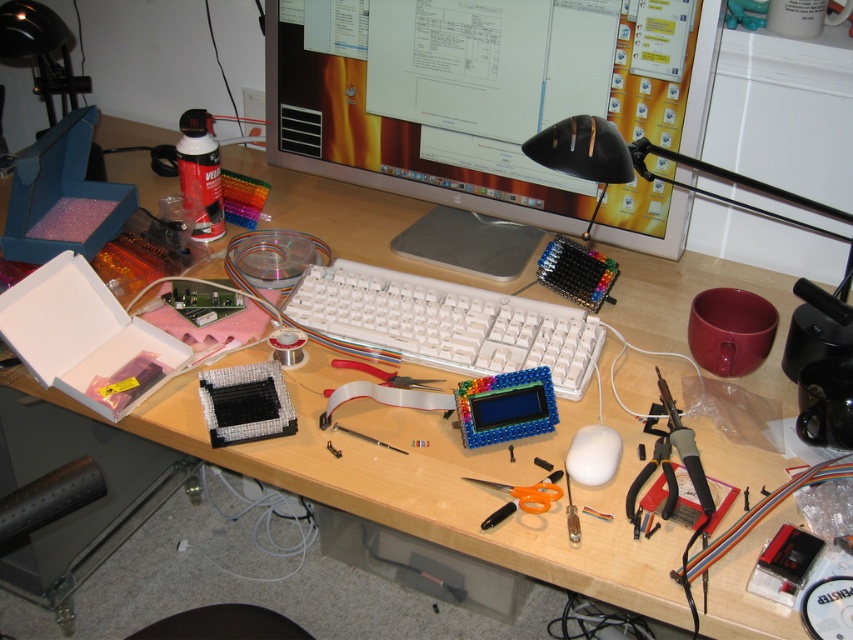
Which is more to the left, white plastic keyboard at center or orange plastic scissors at center?

Positioned to the left is white plastic keyboard at center.

Who is lower down, white plastic keyboard at center or orange plastic scissors at center?

orange plastic scissors at center

Who is more distant from viewer, (x=573, y=317) or (x=527, y=486)?

The point (x=573, y=317) is more distant.

Locate an element on the screen. The height and width of the screenshot is (640, 853). white plastic keyboard at center is located at coordinates (447, 323).

Locate an element on the screen. This screenshot has height=640, width=853. matte black monitor at center is located at coordinates (479, 104).

In order to click on matte black monitor at center in this screenshot , I will do (x=479, y=104).

What are the coordinates of `matte black monitor at center` in the screenshot? It's located at (479, 104).

Between point (418, 333) and point (686, 456), which one is positioned behind?

The point (418, 333) is behind.

Is white plastic keyboard at center smaller than metallic silver pliers at lower right?

Actually, white plastic keyboard at center might be larger than metallic silver pliers at lower right.

Is point (468, 292) closer to viewer compared to point (691, 435)?

No, (468, 292) is behind (691, 435).

The height and width of the screenshot is (640, 853). I want to click on white plastic keyboard at center, so click(447, 323).